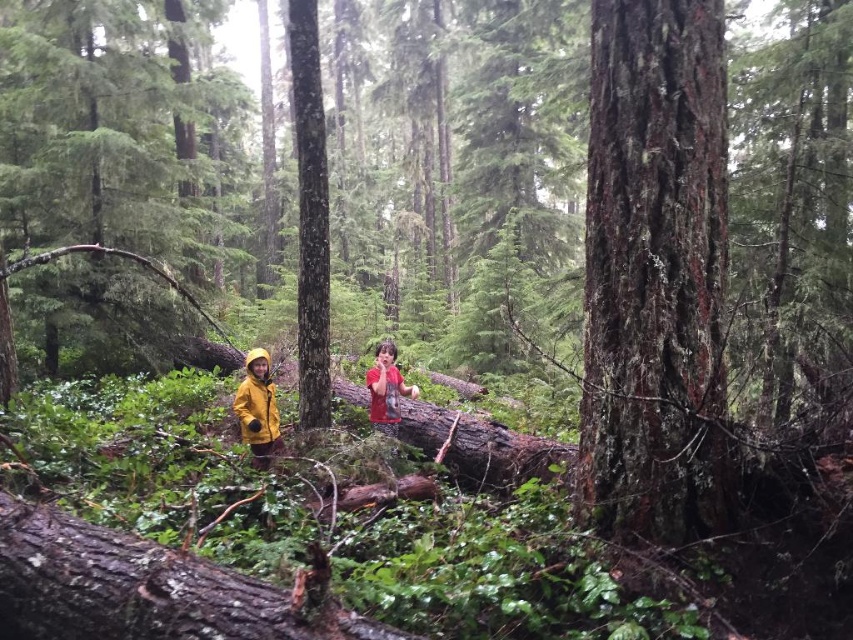
Is smooth bark tree at center wider than red matte shirt at center?

Indeed, smooth bark tree at center has a greater width compared to red matte shirt at center.

Who is shorter, smooth bark tree at center or red matte shirt at center?

With less height is red matte shirt at center.

Is point (320, 179) positioned in front of point (386, 349)?

Yes, it is in front of point (386, 349).

Where is `smooth bark tree at center`? The width and height of the screenshot is (853, 640). smooth bark tree at center is located at coordinates (310, 214).

Between point (264, 467) and point (379, 356), which one is positioned in front?

Point (264, 467)

Does point (262, 429) lie in front of point (408, 390)?

Yes, it is in front of point (408, 390).

Locate an element on the screen. The image size is (853, 640). yellow matte raincoat at lower left is located at coordinates (258, 410).

At what (x,y) coordinates should I click in order to perform the action: click on yellow matte raincoat at lower left. Please return your answer as a coordinate pair (x, y). The image size is (853, 640). Looking at the image, I should click on (258, 410).

Between point (695, 68) and point (372, 396), which one is positioned behind?

The point (372, 396) is behind.

Who is more distant from viewer, (x=694, y=396) or (x=376, y=396)?

Positioned behind is point (x=376, y=396).

At what (x,y) coordinates should I click in order to perform the action: click on smooth dark brown tree trunk at center. Please return your answer as a coordinate pair (x, y). Image resolution: width=853 pixels, height=640 pixels. Looking at the image, I should click on (654, 273).